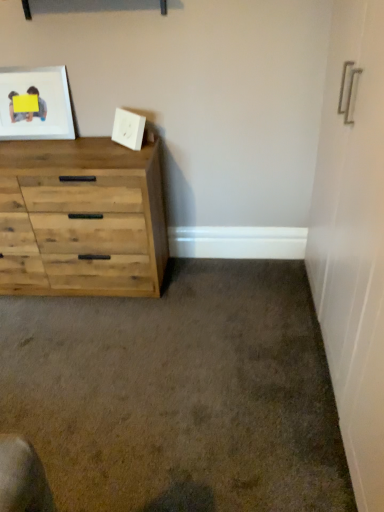
Question: Is natural wood chest of drawers at left completely or partially inside white matte picture frame at upper center, which is counted as the 1th picture frame, starting from the right?

Choices:
 (A) yes
 (B) no

Answer: (B)

Question: From the image's perspective, does white matte picture frame at upper center, which ranks as the 2th picture frame in left-to-right order, appear lower than natural wood chest of drawers at left?

Choices:
 (A) no
 (B) yes

Answer: (A)

Question: From a real-world perspective, is white matte picture frame at upper center, which is counted as the 1th picture frame, starting from the right, physically above natural wood chest of drawers at left?

Choices:
 (A) yes
 (B) no

Answer: (A)

Question: Is white matte picture frame at upper center, which ranks as the 2th picture frame in left-to-right order, not inside natural wood chest of drawers at left?

Choices:
 (A) no
 (B) yes

Answer: (B)

Question: Is white matte picture frame at upper center, which ranks as the 2th picture frame in left-to-right order, taller than natural wood chest of drawers at left?

Choices:
 (A) no
 (B) yes

Answer: (A)

Question: Is point coord(144,228) closer or farther from the camera than point coord(119,112)?

Choices:
 (A) farther
 (B) closer

Answer: (A)

Question: From the image's perspective, is natural wood chest of drawers at left located above or below white matte picture frame at upper center, which ranks as the 2th picture frame in left-to-right order?

Choices:
 (A) below
 (B) above

Answer: (A)

Question: In terms of width, does natural wood chest of drawers at left look wider or thinner when compared to white matte picture frame at upper center, which is counted as the 1th picture frame, starting from the right?

Choices:
 (A) thin
 (B) wide

Answer: (B)

Question: From a real-world perspective, is natural wood chest of drawers at left physically located above or below white matte picture frame at upper center, which is counted as the 1th picture frame, starting from the right?

Choices:
 (A) below
 (B) above

Answer: (A)

Question: From the image's perspective, relative to matte wooden picture frame at upper left, marked as the 2th picture frame in a right-to-left arrangement, is natural wood chest of drawers at left above or below?

Choices:
 (A) above
 (B) below

Answer: (B)

Question: From their relative heights in the image, would you say natural wood chest of drawers at left is taller or shorter than matte wooden picture frame at upper left, marked as the 2th picture frame in a right-to-left arrangement?

Choices:
 (A) tall
 (B) short

Answer: (A)

Question: In the image, is natural wood chest of drawers at left positioned in front of or behind matte wooden picture frame at upper left, arranged as the first picture frame when viewed from the left?

Choices:
 (A) behind
 (B) front

Answer: (B)

Question: From a real-world perspective, is natural wood chest of drawers at left positioned above or below matte wooden picture frame at upper left, marked as the 2th picture frame in a right-to-left arrangement?

Choices:
 (A) above
 (B) below

Answer: (B)

Question: In terms of width, does matte wooden picture frame at upper left, arranged as the first picture frame when viewed from the left, look wider or thinner when compared to natural wood chest of drawers at left?

Choices:
 (A) wide
 (B) thin

Answer: (B)

Question: From a real-world perspective, is matte wooden picture frame at upper left, marked as the 2th picture frame in a right-to-left arrangement, positioned above or below natural wood chest of drawers at left?

Choices:
 (A) below
 (B) above

Answer: (B)